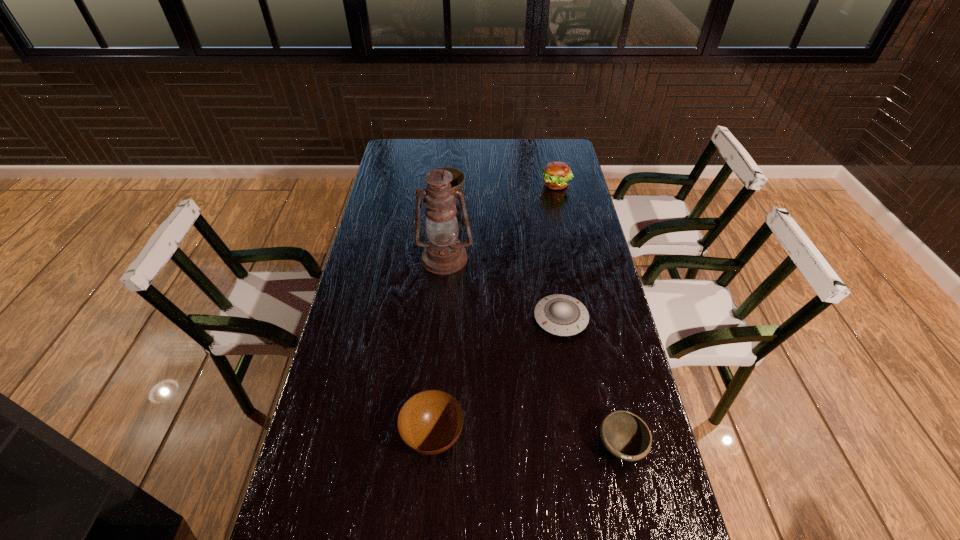
Point out which bowl is positioned as the second nearest to the shortest bowl. Please provide its 2D coordinates. Your answer should be formatted as a tuple, i.e. [(x, y)], where the tuple contains the x and y coordinates of a point satisfying the conditions above.

[(457, 182)]

Find the location of a particular element. vacant space that satisfies the following two spatial constraints: 1. on the front side of the fourth farthest object; 2. on the right side of the farthest bowl is located at coordinates (436, 319).

Locate an element on the screen. vacant space that satisfies the following two spatial constraints: 1. on the back side of the hamburger; 2. on the right side of the second shortest bowl is located at coordinates (452, 185).

Identify the location of free space that satisfies the following two spatial constraints: 1. on the back side of the farthest bowl; 2. on the right side of the hamburger. (448, 185).

The width and height of the screenshot is (960, 540). Find the location of `vacant point that satisfies the following two spatial constraints: 1. on the front side of the second shortest bowl; 2. on the left side of the oil lamp`. vacant point that satisfies the following two spatial constraints: 1. on the front side of the second shortest bowl; 2. on the left side of the oil lamp is located at coordinates [430, 436].